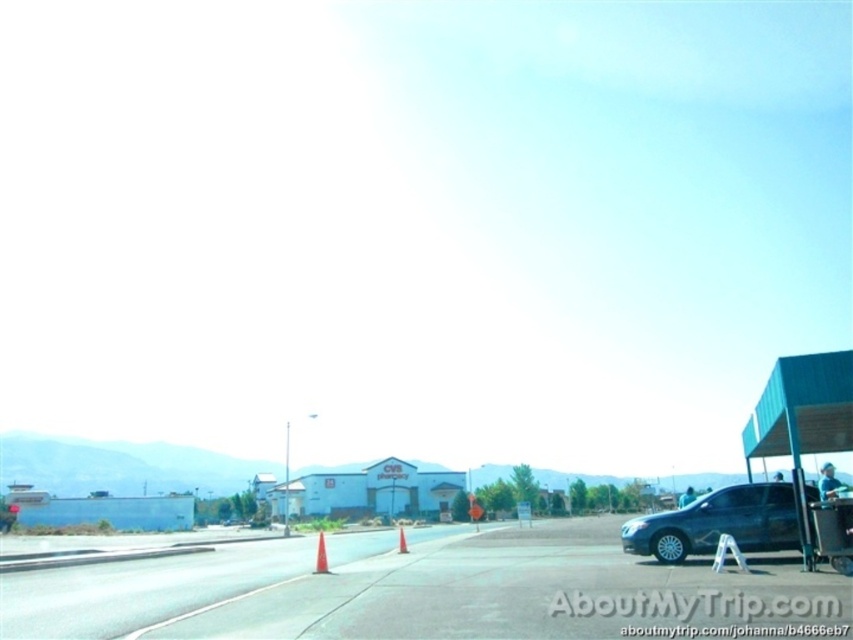
Is point (677, 547) farther from viewer compared to point (519, 506)?

No, (677, 547) is closer to viewer.

Does point (786, 490) lie behind point (527, 506)?

No, (786, 490) is closer to viewer.

Locate an element on the screen. The width and height of the screenshot is (853, 640). shiny silver sedan at lower right is located at coordinates (718, 524).

Is reflective glass stop sign at center to the right of orange plastic traffic cone at center from the viewer's perspective?

Yes, reflective glass stop sign at center is to the right of orange plastic traffic cone at center.

I want to click on reflective glass stop sign at center, so click(523, 509).

Between asphalt road at center and orange matte traffic cone at center, which one appears on the left side from the viewer's perspective?

From the viewer's perspective, orange matte traffic cone at center appears more on the left side.

Which is below, asphalt road at center or orange matte traffic cone at center?

Positioned lower is asphalt road at center.

Find the location of a particular element. The image size is (853, 640). asphalt road at center is located at coordinates (399, 589).

You are a GUI agent. You are given a task and a screenshot of the screen. Output one action in this format:
    pyautogui.click(x=<x>, y=<y>)
    Task: Click on the asphalt road at center
    The image size is (853, 640).
    Given the screenshot: What is the action you would take?
    pyautogui.click(x=399, y=589)